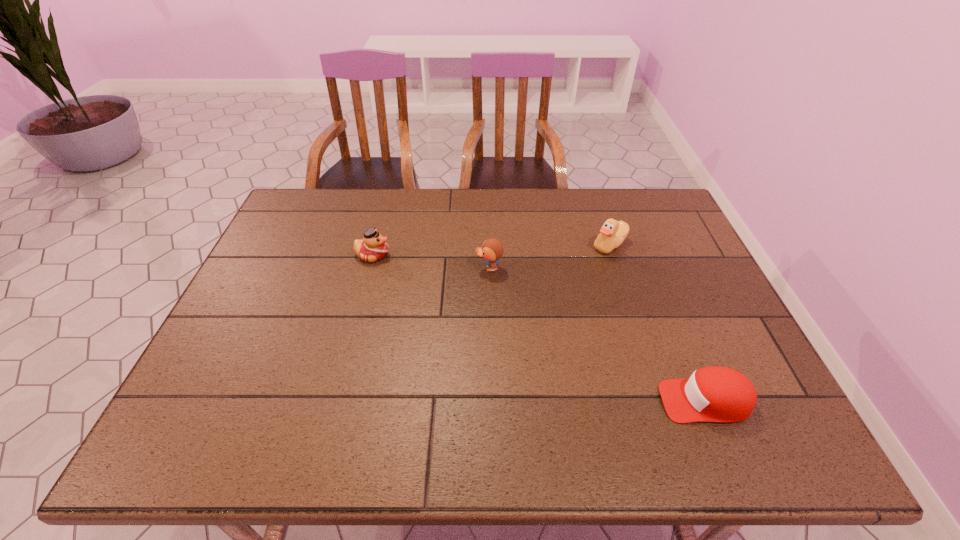
Locate an element on the screen. The width and height of the screenshot is (960, 540). vacant space in between the leftmost duck and the baseball cap is located at coordinates (539, 328).

Locate an element on the screen. Image resolution: width=960 pixels, height=540 pixels. empty location between the rightmost duck and the third object from right to left is located at coordinates pyautogui.click(x=549, y=256).

Select which object appears as the third closest to the rightmost duck. Please provide its 2D coordinates. Your answer should be formatted as a tuple, i.e. [(x, y)], where the tuple contains the x and y coordinates of a point satisfying the conditions above.

[(373, 247)]

Identify the location of object that is the second closest to the leftmost duck. Image resolution: width=960 pixels, height=540 pixels. (x=613, y=233).

Identify the location of duck that is the closest to the leftmost object. (492, 249).

Find the location of a particular element. duck that is the second closest one to the second object from left to right is located at coordinates (613, 233).